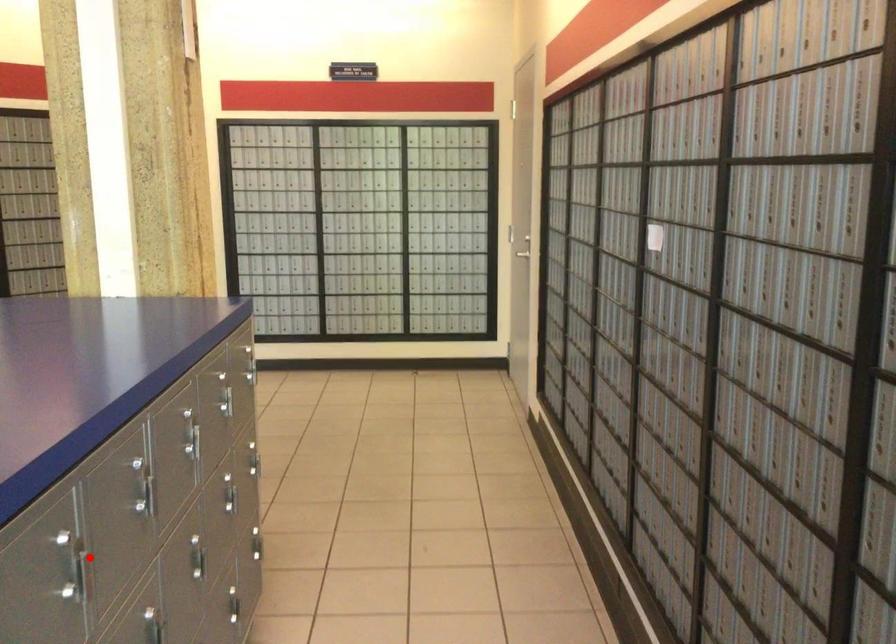
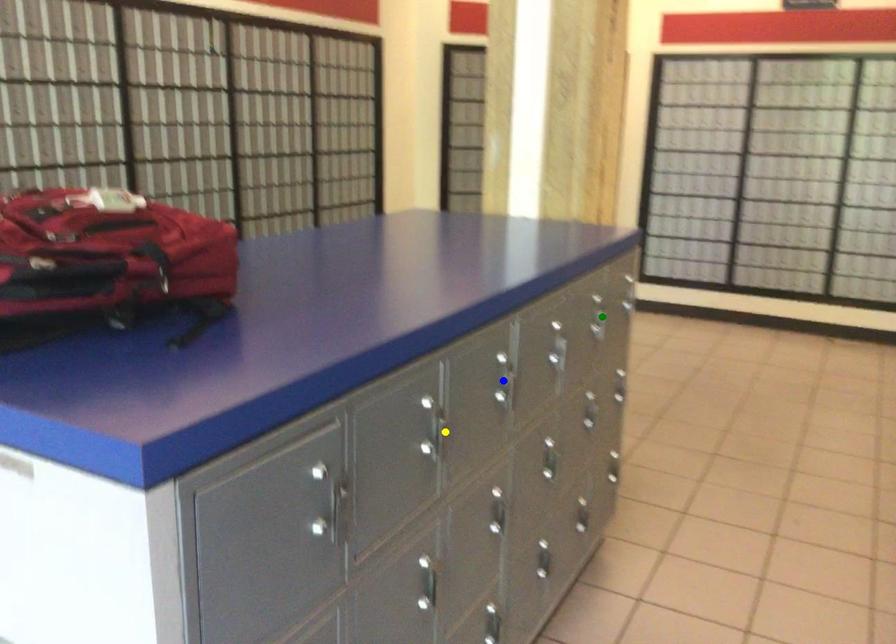
Question: I am providing you with two images of the same scene from different viewpoints. A red point is marked on the first image. You are given multiple points on the second image. Which spot in image 2 lines up with the point in image 1?

Choices:
 (A) blue point
 (B) yellow point
 (C) green point

Answer: (B)